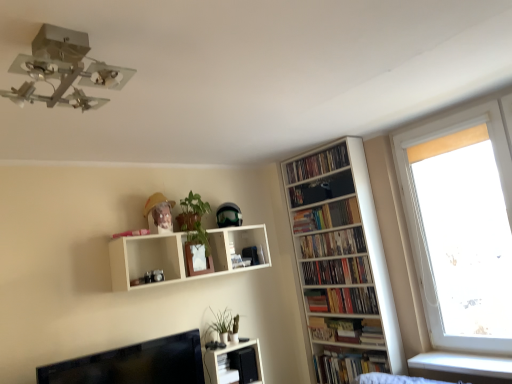
Find the location of a particular element. This screenshot has width=512, height=384. vacant space situated above hardcover books at center-right, placed as the 4th book when sorted from bottom to top (from a real-world perspective) is located at coordinates (328, 232).